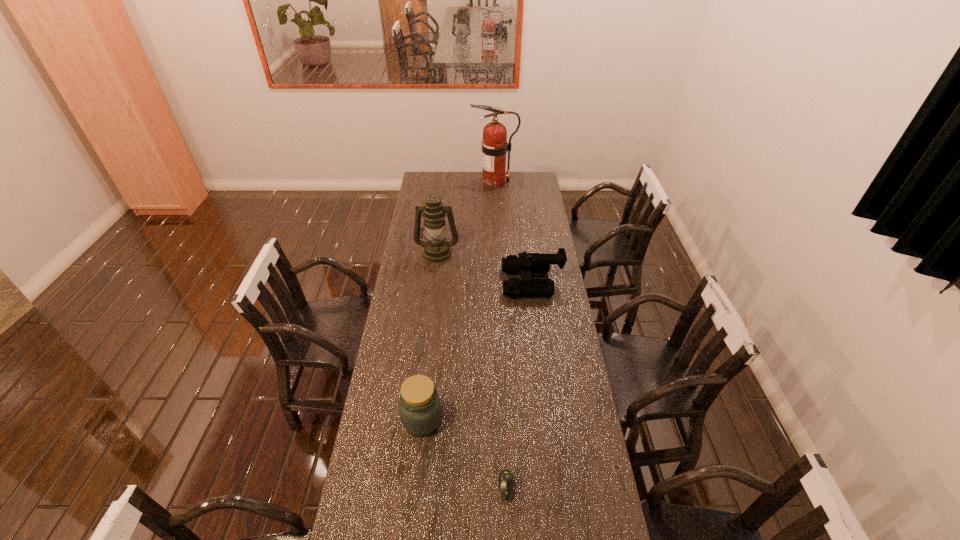
This screenshot has height=540, width=960. Find the location of `fire extinguisher positioned at the right edge`. fire extinguisher positioned at the right edge is located at coordinates (494, 145).

The width and height of the screenshot is (960, 540). Find the location of `binoculars located in the right edge section of the desktop`. binoculars located in the right edge section of the desktop is located at coordinates (527, 263).

You are a GUI agent. You are given a task and a screenshot of the screen. Output one action in this format:
    pyautogui.click(x=<x>, y=<y>)
    Task: Click on the object that is positioned at the far right corner
    The image size is (960, 540).
    Given the screenshot: What is the action you would take?
    pyautogui.click(x=494, y=145)

Where is `vacant space at the left edge of the desktop`? The image size is (960, 540). vacant space at the left edge of the desktop is located at coordinates (400, 368).

Locate an element on the screen. This screenshot has width=960, height=540. vacant space at the right edge of the desktop is located at coordinates (557, 294).

The width and height of the screenshot is (960, 540). What are the coordinates of `vacant area that lies between the oil lamp and the fourth farthest object` in the screenshot? It's located at (430, 335).

Find the location of a particular element. free space between the fourth farthest object and the computer mouse is located at coordinates (465, 453).

You are a GUI agent. You are given a task and a screenshot of the screen. Output one action in this format:
    pyautogui.click(x=<x>, y=<y>)
    Task: Click on the free point between the fire extinguisher and the third farthest object
    This screenshot has height=540, width=960.
    Given the screenshot: What is the action you would take?
    pyautogui.click(x=513, y=232)

The width and height of the screenshot is (960, 540). I want to click on vacant area between the shortest object and the farthest object, so click(500, 334).

Identify the location of blank region between the third farthest object and the shortest object. The image size is (960, 540). (519, 384).